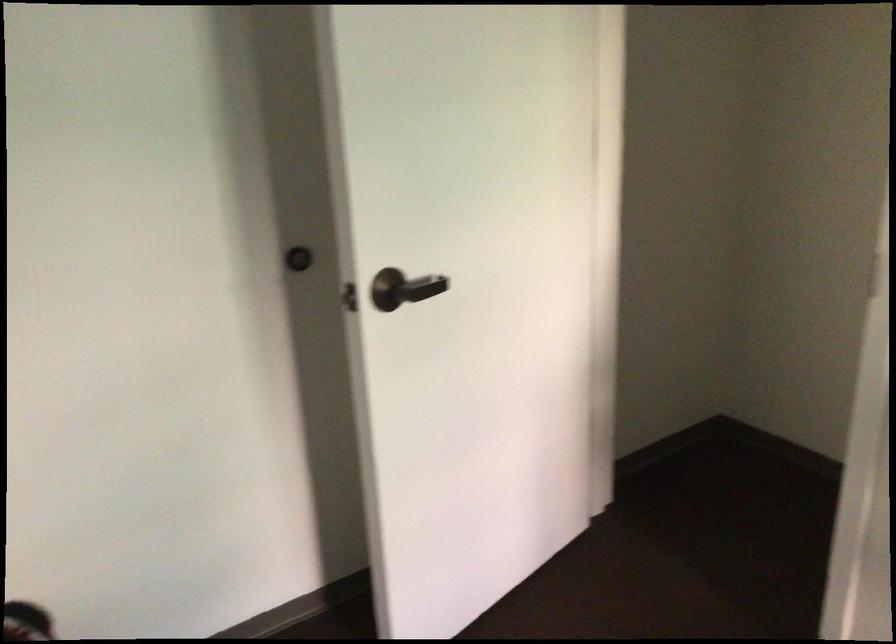
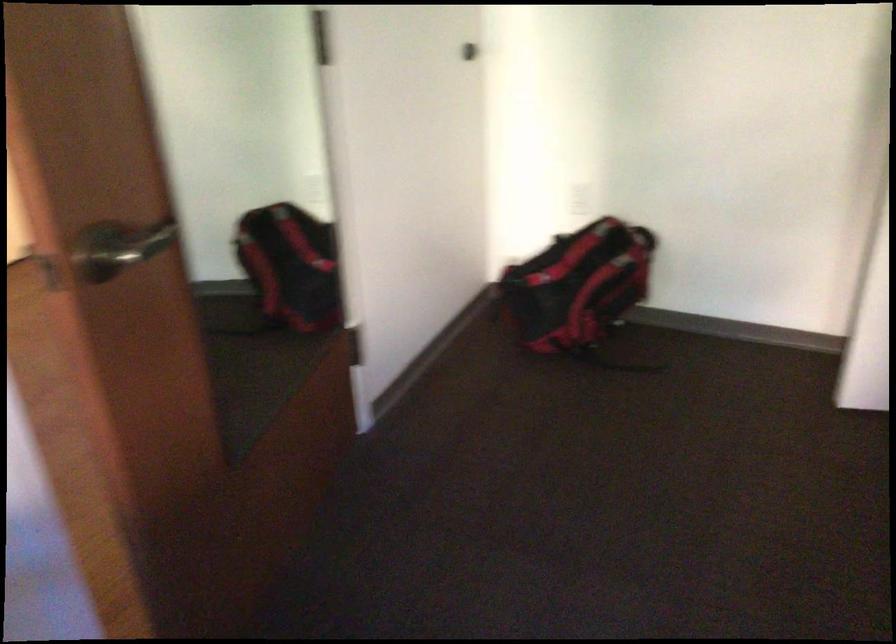
Based on the continuous images, in which direction is the camera rotating?

The camera rotated toward left-down.